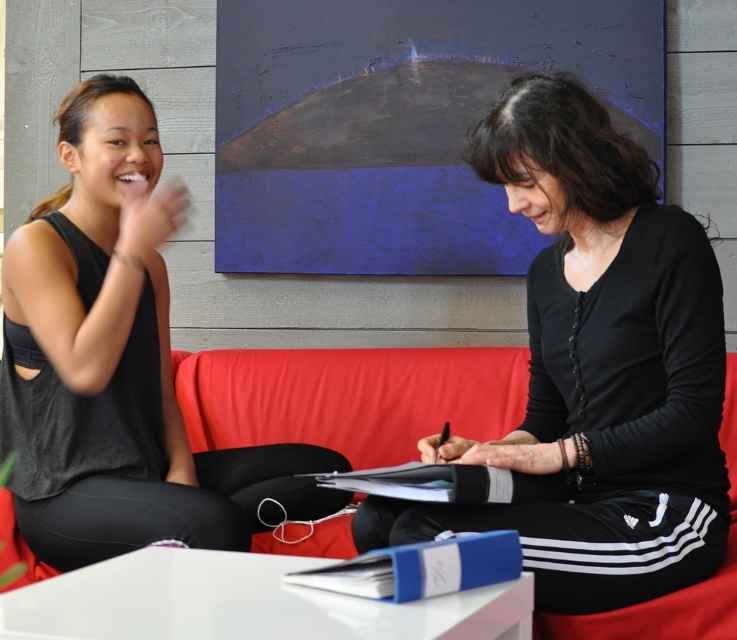
Question: Can you confirm if black matte/black jersey at center is positioned to the left of black matte tank top at left?

Choices:
 (A) yes
 (B) no

Answer: (B)

Question: Based on their relative distances, which object is farther from the black matte/black jersey at center?

Choices:
 (A) red fabric couch at center
 (B) black matte tank top at left

Answer: (A)

Question: Among these objects, which one is nearest to the camera?

Choices:
 (A) red fabric couch at center
 (B) black matte tank top at left

Answer: (B)

Question: Which object is positioned closest to the black matte/black jersey at center?

Choices:
 (A) red fabric couch at center
 (B) black matte tank top at left

Answer: (B)

Question: Can you confirm if black matte/black jersey at center is bigger than black matte tank top at left?

Choices:
 (A) yes
 (B) no

Answer: (B)

Question: Where is black matte/black jersey at center located in relation to red fabric couch at center in the image?

Choices:
 (A) left
 (B) right

Answer: (B)